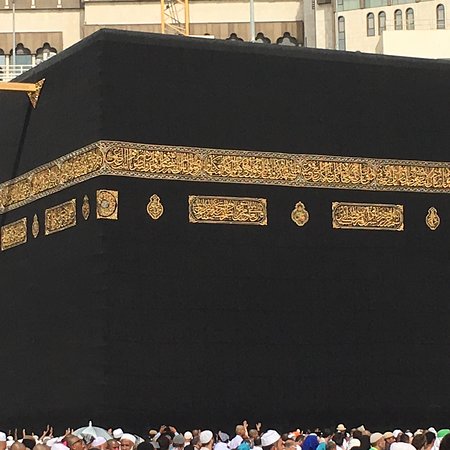
In order to click on gold decorations in rectangles in this screenshot , I will do `click(163, 159)`, `click(232, 206)`, `click(385, 222)`, `click(62, 210)`, `click(7, 237)`, `click(109, 200)`, `click(43, 185)`.